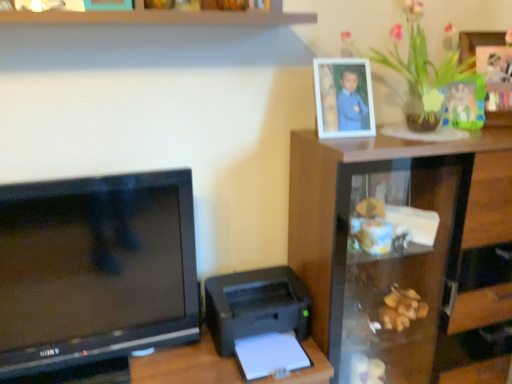
The height and width of the screenshot is (384, 512). What do you see at coordinates (343, 98) in the screenshot?
I see `white plastic picture frame at upper right` at bounding box center [343, 98].

Describe the element at coordinates (95, 269) in the screenshot. Image resolution: width=512 pixels, height=384 pixels. I see `black glossy television at left` at that location.

The image size is (512, 384). What do you see at coordinates (404, 255) in the screenshot?
I see `transparent glass cabinet at upper right` at bounding box center [404, 255].

Where is `green leafy plant at upper right`? green leafy plant at upper right is located at coordinates (429, 72).

Would you consider black plastic printer at lower right to be distant from transparent glass cabinet at upper right?

No, black plastic printer at lower right is in close proximity to transparent glass cabinet at upper right.

Where is `furniture on the right side of black plastic printer at lower right`? This screenshot has width=512, height=384. furniture on the right side of black plastic printer at lower right is located at coordinates (404, 255).

From a real-world perspective, is black plastic printer at lower right positioned above or below transparent glass cabinet at upper right?

In terms of real-world spatial position, black plastic printer at lower right is below transparent glass cabinet at upper right.

Could you tell me if black plastic printer at lower right is turned towards transparent glass cabinet at upper right?

No, black plastic printer at lower right is not turned towards transparent glass cabinet at upper right.

Is black plastic printer at lower right not within black glossy television at left?

Yes, black plastic printer at lower right is located beyond the bounds of black glossy television at left.

Could you tell me if black plastic printer at lower right is turned towards black glossy television at left?

No, black plastic printer at lower right is not oriented towards black glossy television at left.

Is the position of black plastic printer at lower right less distant than that of black glossy television at left?

No, black plastic printer at lower right is further to the viewer.

Would you consider green leafy plant at upper right to be distant from transparent glass cabinet at upper right?

They are positioned close to each other.

Between point (460, 70) and point (438, 144), which one is positioned in front?

Positioned in front is point (438, 144).

Considering the sizes of green leafy plant at upper right and transparent glass cabinet at upper right in the image, is green leafy plant at upper right wider or thinner than transparent glass cabinet at upper right?

In the image, green leafy plant at upper right appears to be more narrow than transparent glass cabinet at upper right.

Is point (162, 316) behind point (461, 64)?

No, (162, 316) is in front of (461, 64).

Can you confirm if black glossy television at left is smaller than green leafy plant at upper right?

Indeed, black glossy television at left has a smaller size compared to green leafy plant at upper right.

Is black glossy television at left placed right next to green leafy plant at upper right?

No, black glossy television at left is not making contact with green leafy plant at upper right.

How far apart are black glossy television at left and green leafy plant at upper right?

They are 1.13 meters apart.

Can green leafy plant at upper right be found inside white plastic picture frame at upper right?

No.

Is white plastic picture frame at upper right in front of green leafy plant at upper right?

No, white plastic picture frame at upper right is further to the viewer.

Does white plastic picture frame at upper right touch green leafy plant at upper right?

No, white plastic picture frame at upper right is not making contact with green leafy plant at upper right.

Is white plastic picture frame at upper right oriented away from transparent glass cabinet at upper right?

No, white plastic picture frame at upper right is not facing away from transparent glass cabinet at upper right.

Based on the photo, which object is more forward, white plastic picture frame at upper right or transparent glass cabinet at upper right?

Positioned in front is transparent glass cabinet at upper right.

Can you confirm if white plastic picture frame at upper right is shorter than transparent glass cabinet at upper right?

Correct, white plastic picture frame at upper right is not as tall as transparent glass cabinet at upper right.

Considering the relative positions of white plastic picture frame at upper right and transparent glass cabinet at upper right in the image provided, is white plastic picture frame at upper right to the left or to the right of transparent glass cabinet at upper right?

white plastic picture frame at upper right is positioned on transparent glass cabinet at upper right's left side.

Does green leafy plant at upper right have a larger size compared to black glossy television at left?

Yes, green leafy plant at upper right is bigger than black glossy television at left.

Is green leafy plant at upper right wider or thinner than black glossy television at left?

Considering their sizes, green leafy plant at upper right looks broader than black glossy television at left.

What's the angular difference between green leafy plant at upper right and black glossy television at left's facing directions?

There is a 0.00104-degree angle between the facing directions of green leafy plant at upper right and black glossy television at left.

Locate an element on the screen. This screenshot has width=512, height=384. furniture above the black plastic printer at lower right (from a real-world perspective) is located at coordinates (404, 255).

Find the location of a particular element. Image resolution: width=512 pixels, height=384 pixels. television above the black plastic printer at lower right (from the image's perspective) is located at coordinates (95, 269).

From the picture: Based on their spatial positions, is transparent glass cabinet at upper right or green leafy plant at upper right closer to black plastic printer at lower right?

Based on the image, transparent glass cabinet at upper right appears to be nearer to black plastic printer at lower right.

From the image, which object appears to be nearer to black plastic printer at lower right, transparent glass cabinet at upper right or black glossy television at left?

Among the two, black glossy television at left is located nearer to black plastic printer at lower right.

Estimate the real-world distances between objects in this image. Which object is closer to black plastic printer at lower right, white plastic picture frame at upper right or black glossy television at left?

The object closer to black plastic printer at lower right is black glossy television at left.

Consider the image. Considering their positions, is transparent glass cabinet at upper right positioned further to black glossy television at left than white plastic picture frame at upper right?

white plastic picture frame at upper right lies further to black glossy television at left than the other object.

Which object lies nearer to the anchor point black plastic printer at lower right, black glossy television at left or white plastic picture frame at upper right?

Based on the image, black glossy television at left appears to be nearer to black plastic printer at lower right.

Estimate the real-world distances between objects in this image. Which object is closer to white plastic picture frame at upper right, green leafy plant at upper right or black glossy television at left?

green leafy plant at upper right is positioned closer to the anchor white plastic picture frame at upper right.

From the image, which object appears to be nearer to green leafy plant at upper right, black plastic printer at lower right or black glossy television at left?

Among the two, black plastic printer at lower right is located nearer to green leafy plant at upper right.

Looking at the image, which one is located closer to green leafy plant at upper right, transparent glass cabinet at upper right or black glossy television at left?

The object closer to green leafy plant at upper right is transparent glass cabinet at upper right.

Find the location of a particular element. picture frame located between black glossy television at left and transparent glass cabinet at upper right in the left-right direction is located at coordinates (343, 98).

Find the location of `printer between black glossy television at left and green leafy plant at upper right`. printer between black glossy television at left and green leafy plant at upper right is located at coordinates (256, 306).

I want to click on furniture between green leafy plant at upper right and black plastic printer at lower right vertically, so coord(404,255).

Identify the location of picture frame located between black glossy television at left and green leafy plant at upper right in the left-right direction. (343, 98).